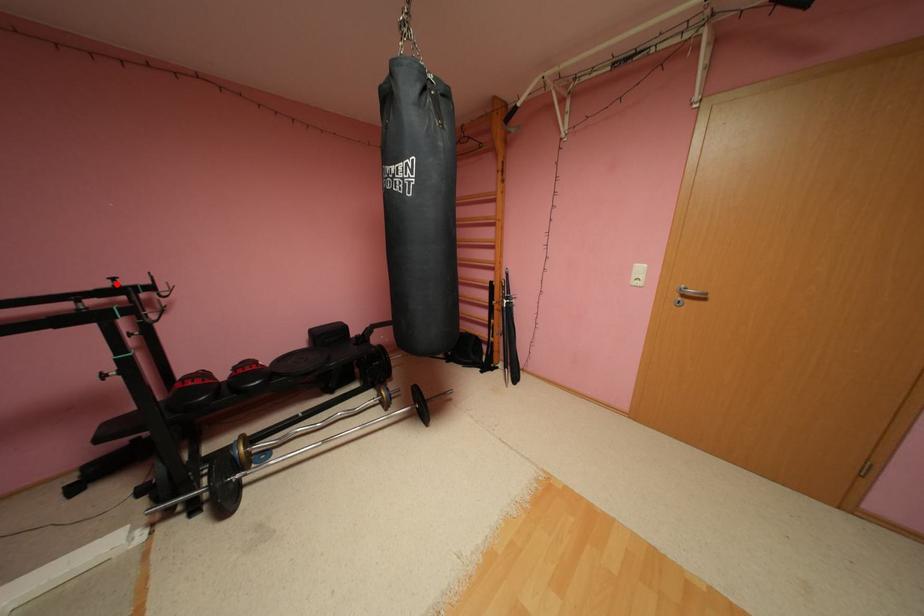
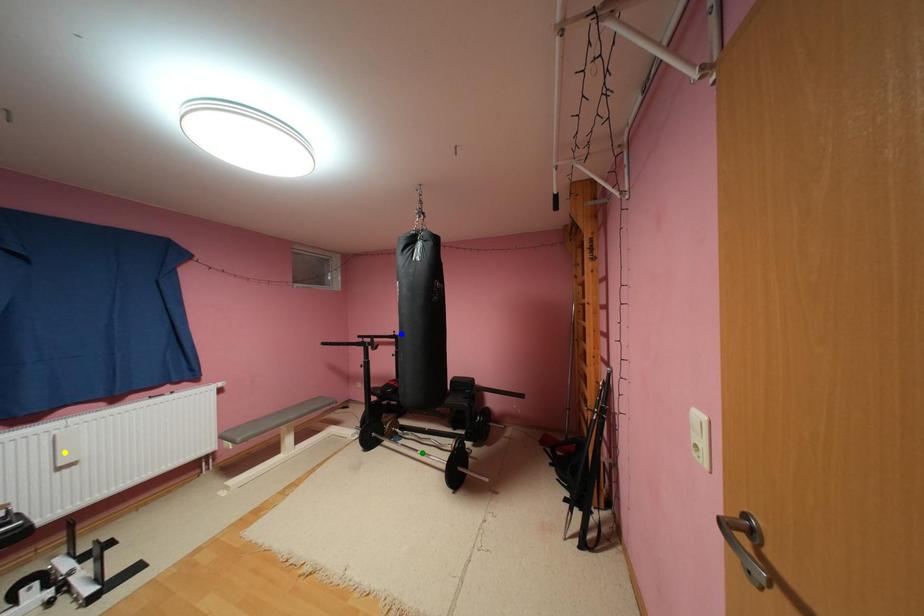
Question: I am providing you with two images of the same scene from different viewpoints. A red point is marked on the first image. You are given multiple points on the second image. Which point in image 2 represents the same 3d spot as the red point in image 1?

Choices:
 (A) blue point
 (B) yellow point
 (C) green point

Answer: (A)